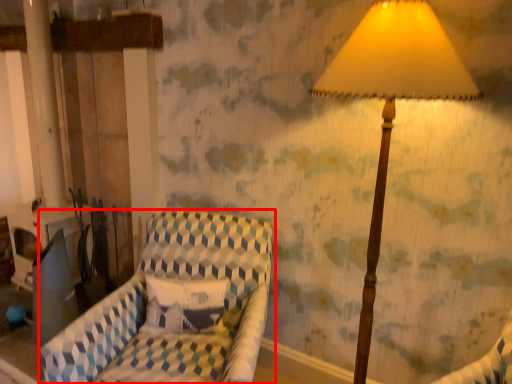
Question: Where is furniture (annotated by the red box) located in relation to lamp in the image?

Choices:
 (A) left
 (B) right

Answer: (A)